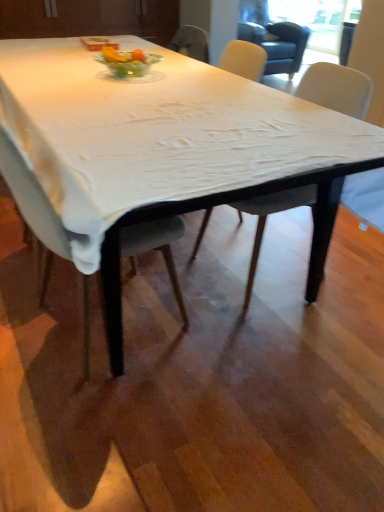
Question: Considering the relative sizes of matte gray chair at center, marked as the 1th chair in a left-to-right arrangement, and clear glass bowl at center in the image provided, is matte gray chair at center, marked as the 1th chair in a left-to-right arrangement, bigger than clear glass bowl at center?

Choices:
 (A) no
 (B) yes

Answer: (B)

Question: Is matte gray chair at center, marked as the 1th chair in a left-to-right arrangement, behind clear glass bowl at center?

Choices:
 (A) no
 (B) yes

Answer: (A)

Question: Can you confirm if matte gray chair at center, which is the 2th chair in right-to-left order, is positioned to the left of clear glass bowl at center?

Choices:
 (A) yes
 (B) no

Answer: (A)

Question: Considering the relative sizes of matte gray chair at center, which is the 2th chair in right-to-left order, and clear glass bowl at center in the image provided, is matte gray chair at center, which is the 2th chair in right-to-left order, thinner than clear glass bowl at center?

Choices:
 (A) yes
 (B) no

Answer: (B)

Question: From the image's perspective, is matte gray chair at center, which is the 2th chair in right-to-left order, located above clear glass bowl at center?

Choices:
 (A) yes
 (B) no

Answer: (B)

Question: In the image, is matte gray chair at center, marked as the 1th chair in a left-to-right arrangement, on the left side or the right side of white fabric chair at center, which is the first chair from right to left?

Choices:
 (A) right
 (B) left

Answer: (B)

Question: Is matte gray chair at center, marked as the 1th chair in a left-to-right arrangement, inside the boundaries of white fabric chair at center, which is the first chair from right to left, or outside?

Choices:
 (A) inside
 (B) outside

Answer: (B)

Question: From a real-world perspective, relative to white fabric chair at center, positioned as the 2th chair in left-to-right order, is matte gray chair at center, marked as the 1th chair in a left-to-right arrangement, vertically above or below?

Choices:
 (A) above
 (B) below

Answer: (A)

Question: Looking at their shapes, would you say matte gray chair at center, which is the 2th chair in right-to-left order, is wider or thinner than white fabric chair at center, positioned as the 2th chair in left-to-right order?

Choices:
 (A) wide
 (B) thin

Answer: (A)

Question: Is point (x=84, y=286) closer or farther from the camera than point (x=221, y=161)?

Choices:
 (A) farther
 (B) closer

Answer: (A)

Question: Is matte gray chair at center, which is the 2th chair in right-to-left order, inside the boundaries of white cloth-covered table at center, or outside?

Choices:
 (A) outside
 (B) inside

Answer: (B)

Question: In terms of width, does matte gray chair at center, which is the 2th chair in right-to-left order, look wider or thinner when compared to white cloth-covered table at center?

Choices:
 (A) thin
 (B) wide

Answer: (A)

Question: From a real-world perspective, is matte gray chair at center, marked as the 1th chair in a left-to-right arrangement, above or below white cloth-covered table at center?

Choices:
 (A) below
 (B) above

Answer: (A)

Question: From a real-world perspective, is clear glass bowl at center physically located above or below white cloth-covered table at center?

Choices:
 (A) below
 (B) above

Answer: (B)

Question: Is clear glass bowl at center to the left or to the right of white cloth-covered table at center in the image?

Choices:
 (A) right
 (B) left

Answer: (A)